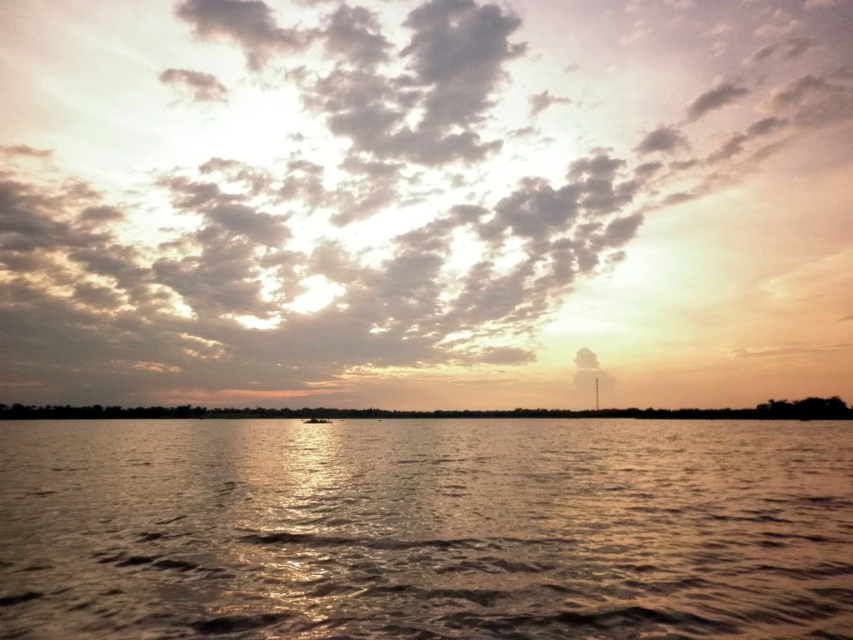
You are standing on the shore of the lake and want to take a photo of the sandy textured clouds at upper center. If your camera has a maximum zoom range of 200 meters, can you capture the clouds in full detail without moving closer?

The sandy textured clouds at upper center are 262.65 meters away from the camera. Since the camera can only zoom up to 200 meters, it cannot capture the clouds in full detail without moving closer.

You are an astronomer analyzing the sunset scene. You notice the sandy textured clouds at upper center. Based on their position, could they be obscuring the sun? Please explain using their coordinates.

The sandy textured clouds at upper center are located at coordinates point (425,200). Since the sun is positioned off to the left, the clouds are not directly in line with the sun, so they are not obscuring it.

You are an artist trying to paint this sunset scene. You have a limited amount of gold paint and want to use it where it will cover the most area. Which object should you apply the gold paint to, the glistening water at center or the brown matte land at lower center?

The brown matte land at lower center is larger in size than the glistening water at center, so you should apply the gold paint to the brown matte land at lower center to cover more area.